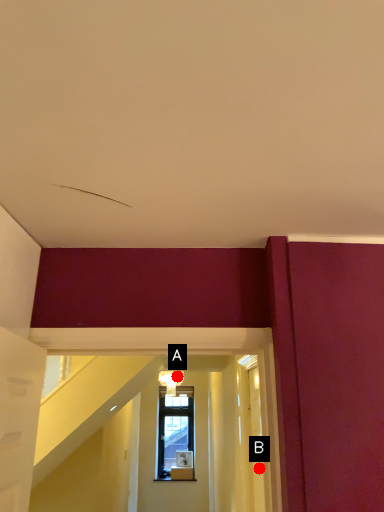
Question: Two points are circled on the image, labeled by A and B beside each circle. Which of the following is the closest to the observer?

Choices:
 (A) A is closer
 (B) B is closer

Answer: (B)